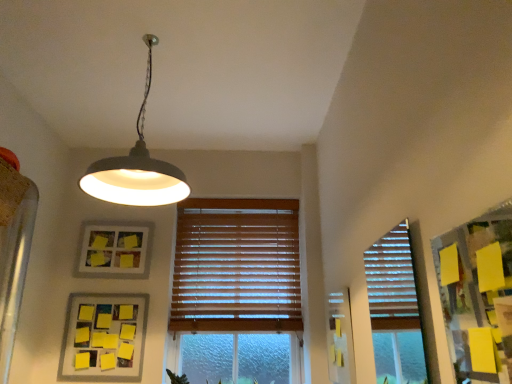
Question: Is matte gray lampshade at upper center bigger than wooden blinds at center?

Choices:
 (A) yes
 (B) no

Answer: (A)

Question: Is matte gray lampshade at upper center further to the viewer compared to wooden blinds at center?

Choices:
 (A) no
 (B) yes

Answer: (A)

Question: Considering the relative sizes of matte gray lampshade at upper center and wooden blinds at center in the image provided, is matte gray lampshade at upper center taller than wooden blinds at center?

Choices:
 (A) yes
 (B) no

Answer: (B)

Question: Does matte gray lampshade at upper center have a lesser height compared to wooden blinds at center?

Choices:
 (A) yes
 (B) no

Answer: (A)

Question: Considering the relative sizes of matte gray lampshade at upper center and wooden blinds at center in the image provided, is matte gray lampshade at upper center wider than wooden blinds at center?

Choices:
 (A) yes
 (B) no

Answer: (A)

Question: In terms of width, does wooden blinds at center look wider or thinner when compared to matte gray lampshade at upper center?

Choices:
 (A) wide
 (B) thin

Answer: (B)

Question: In terms of height, does wooden blinds at center look taller or shorter compared to matte gray lampshade at upper center?

Choices:
 (A) short
 (B) tall

Answer: (B)

Question: Is wooden blinds at center inside the boundaries of matte gray lampshade at upper center, or outside?

Choices:
 (A) outside
 (B) inside

Answer: (A)

Question: Is wooden blinds at center in front of or behind matte gray lampshade at upper center in the image?

Choices:
 (A) front
 (B) behind

Answer: (B)

Question: Does point (142, 142) appear closer or farther from the camera than point (113, 379)?

Choices:
 (A) closer
 (B) farther

Answer: (A)

Question: Relative to yellow matte picture frame at lower left, which appears as the 1th picture frame when viewed from the front, is matte gray lampshade at upper center in front or behind?

Choices:
 (A) front
 (B) behind

Answer: (A)

Question: From a real-world perspective, is matte gray lampshade at upper center above or below yellow matte picture frame at lower left, which appears as the 1th picture frame when viewed from the front?

Choices:
 (A) below
 (B) above

Answer: (B)

Question: Looking at the image, does matte gray lampshade at upper center seem bigger or smaller compared to yellow matte picture frame at lower left, placed as the second picture frame when sorted from top to bottom?

Choices:
 (A) big
 (B) small

Answer: (A)

Question: Looking at the image, does yellow matte picture frame at lower left, marked as the first picture frame in a bottom-to-top arrangement, seem bigger or smaller compared to wooden blinds at center?

Choices:
 (A) big
 (B) small

Answer: (B)

Question: Considering the positions of point (91, 337) and point (172, 322), is point (91, 337) closer or farther from the camera than point (172, 322)?

Choices:
 (A) farther
 (B) closer

Answer: (B)